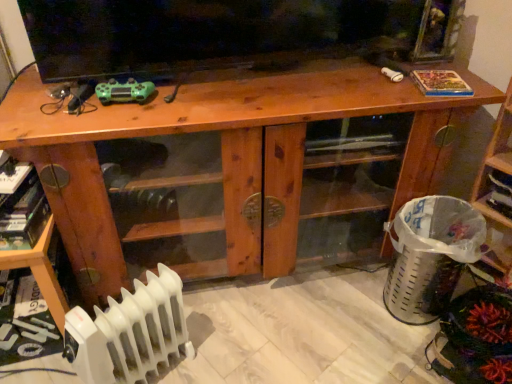
Where is `vacant space in front of green matte controller at upper left`? This screenshot has width=512, height=384. vacant space in front of green matte controller at upper left is located at coordinates pyautogui.click(x=110, y=120).